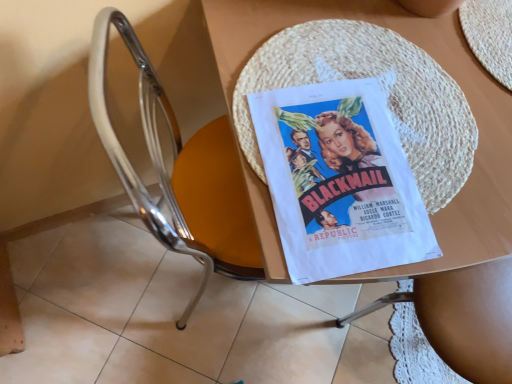
In order to click on empty space that is ontop of wooden table at center (from a real-world perspective) in this screenshot , I will do `click(397, 114)`.